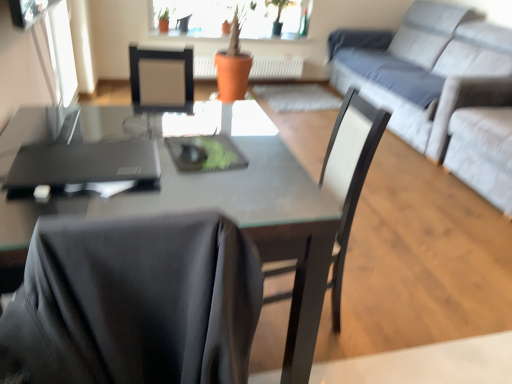
Where is `vacant point to the right of black matte laptop at left`? vacant point to the right of black matte laptop at left is located at coordinates (189, 180).